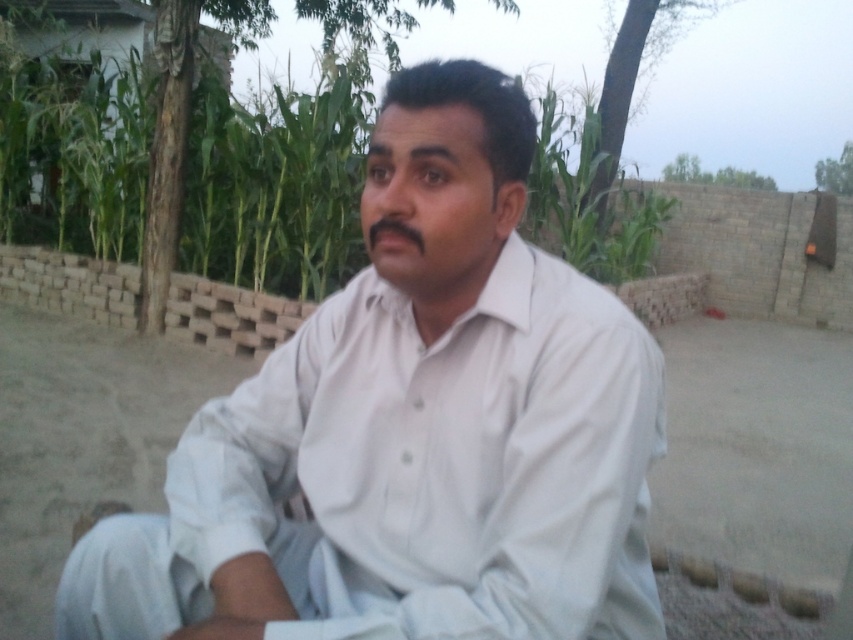
Is white cotton shirt at center below green leafy corn at center?

Yes, white cotton shirt at center is below green leafy corn at center.

Between point (358, 573) and point (141, 150), which one is positioned behind?

Point (141, 150)

The image size is (853, 640). Identify the location of white cotton shirt at center. (412, 429).